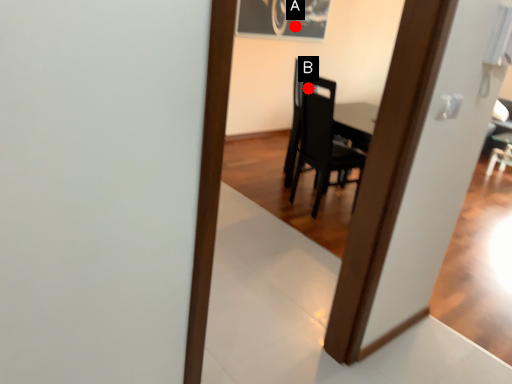
Question: Two points are circled on the image, labeled by A and B beside each circle. Which point is farther to the camera?

Choices:
 (A) A is further
 (B) B is further

Answer: (A)